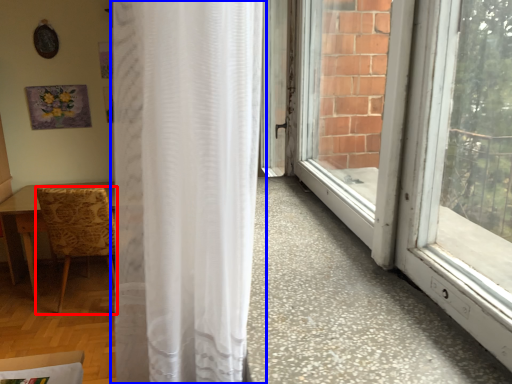
Question: Among these objects, which one is farthest to the camera, chair (highlighted by a red box) or curtain (highlighted by a blue box)?

Choices:
 (A) chair
 (B) curtain

Answer: (A)